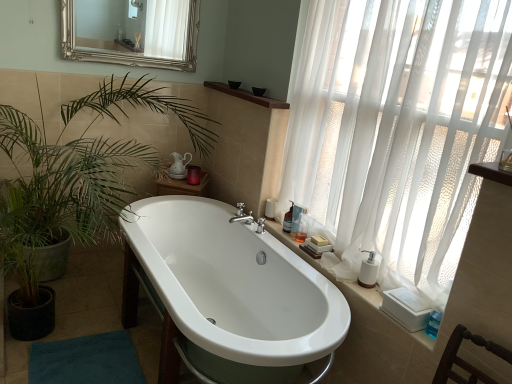
Question: Considering the relative positions of white glossy bathtub at center and white sheer curtain at right in the image provided, is white glossy bathtub at center to the left or to the right of white sheer curtain at right?

Choices:
 (A) left
 (B) right

Answer: (A)

Question: Considering the positions of point (279, 246) and point (437, 226), is point (279, 246) closer or farther from the camera than point (437, 226)?

Choices:
 (A) farther
 (B) closer

Answer: (A)

Question: Which of these objects is positioned closest to the translucent plastic bottle at right, which ranks as the first toiletry in back-to-front order?

Choices:
 (A) brown wood shelf at upper center
 (B) silver/gilded mirror at upper center
 (C) green leafy plant at left
 (D) teal fabric bath mat at lower left
 (E) clear plastic soap dispenser at right, the 2th toiletry viewed from the front

Answer: (E)

Question: Estimate the real-world distances between objects in this image. Which object is closer to the translucent plastic bottle at right, which ranks as the first toiletry in back-to-front order?

Choices:
 (A) clear plastic soap dispenser at right, the 2th toiletry viewed from the front
 (B) silver/gilded mirror at upper center
 (C) white sheer curtain at right
 (D) teal fabric bath mat at lower left
 (E) white glossy bathtub at center

Answer: (A)